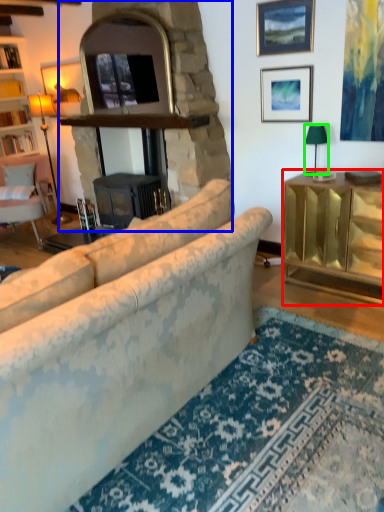
Question: Which is nearer to the cabinetry (highlighted by a red box)? fireplace (highlighted by a blue box) or lamp (highlighted by a green box).

Choices:
 (A) fireplace
 (B) lamp

Answer: (B)